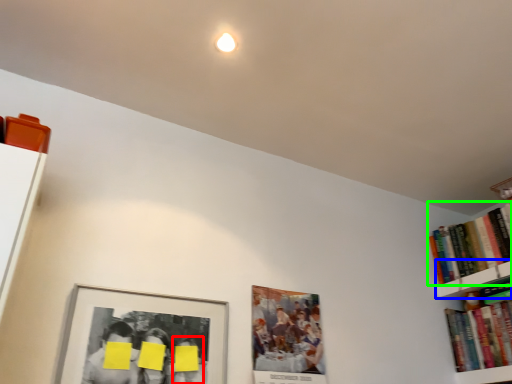
Question: Considering the real-world distances, which object is farthest from person (highlighted by a red box)? shelf (highlighted by a blue box) or book (highlighted by a green box)?

Choices:
 (A) shelf
 (B) book

Answer: (B)